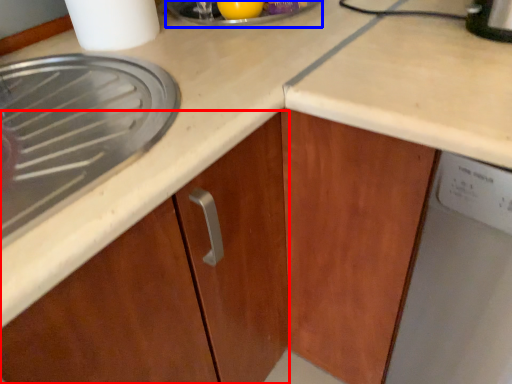
Question: Which of the following is the farthest to the observer, cabinetry (highlighted by a red box) or appliance (highlighted by a blue box)?

Choices:
 (A) cabinetry
 (B) appliance

Answer: (B)